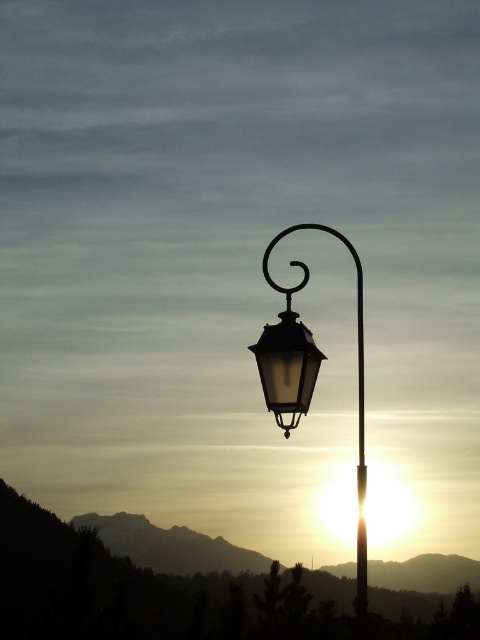
Question: Estimate the real-world distances between objects in this image. Which object is farther from the matte black lantern at center?

Choices:
 (A) matte glass street light at center
 (B) metallic pole at center

Answer: (B)

Question: Which of these objects is positioned farthest from the metallic pole at center?

Choices:
 (A) matte black lantern at center
 (B) matte glass street light at center

Answer: (A)

Question: Is matte glass street light at center above matte black lantern at center?

Choices:
 (A) yes
 (B) no

Answer: (B)

Question: Can you confirm if matte glass street light at center is positioned to the left of metallic pole at center?

Choices:
 (A) no
 (B) yes

Answer: (B)

Question: Considering the relative positions of matte glass street light at center and metallic pole at center in the image provided, where is matte glass street light at center located with respect to metallic pole at center?

Choices:
 (A) left
 (B) right

Answer: (A)

Question: Which of the following is the farthest from the observer?

Choices:
 (A) matte glass street light at center
 (B) metallic pole at center

Answer: (A)